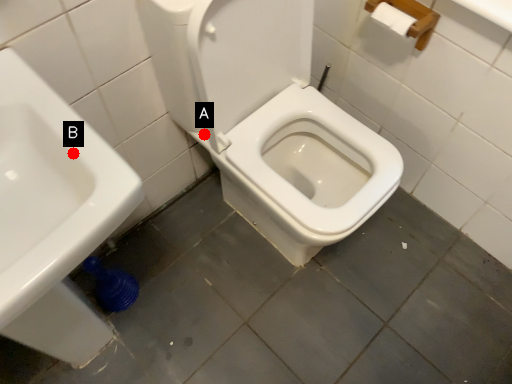
Question: Two points are circled on the image, labeled by A and B beside each circle. Which point appears farthest from the camera in this image?

Choices:
 (A) A is further
 (B) B is further

Answer: (A)